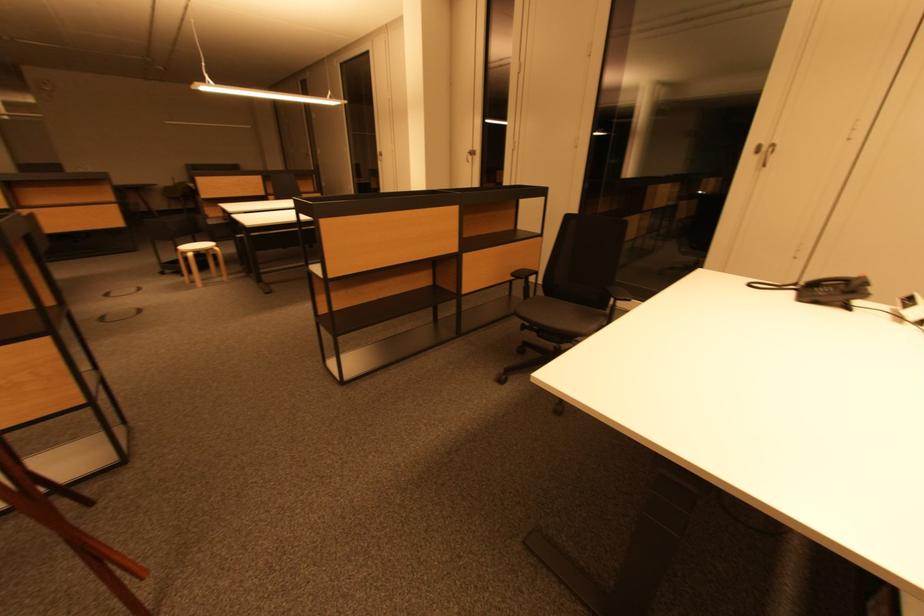
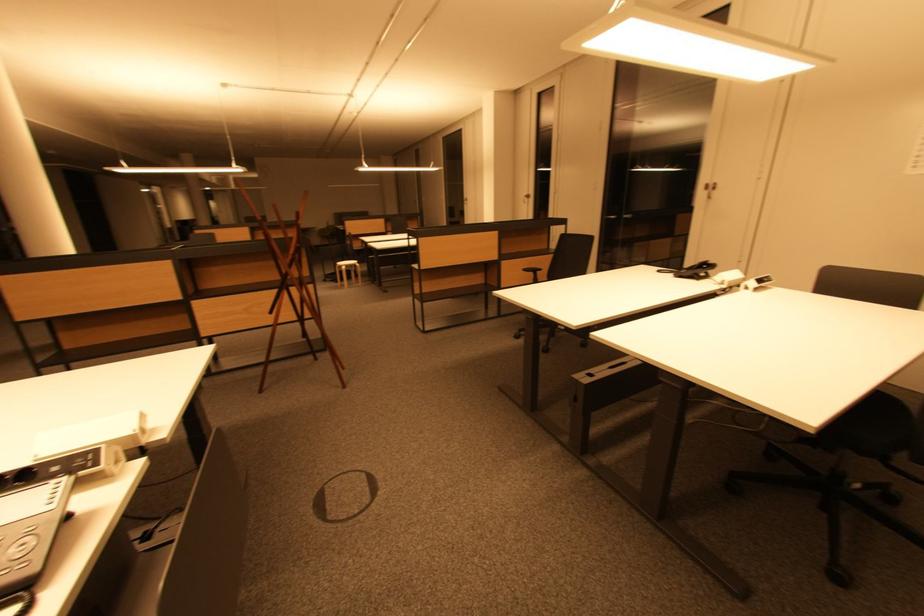
What movement of the cameraman would produce the second image?

The cameraman moved toward right, backward.